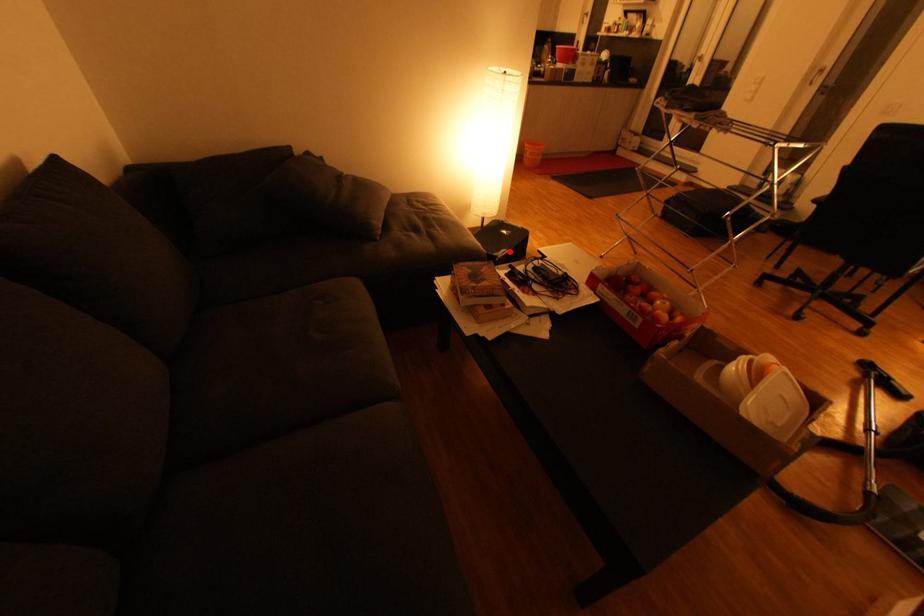
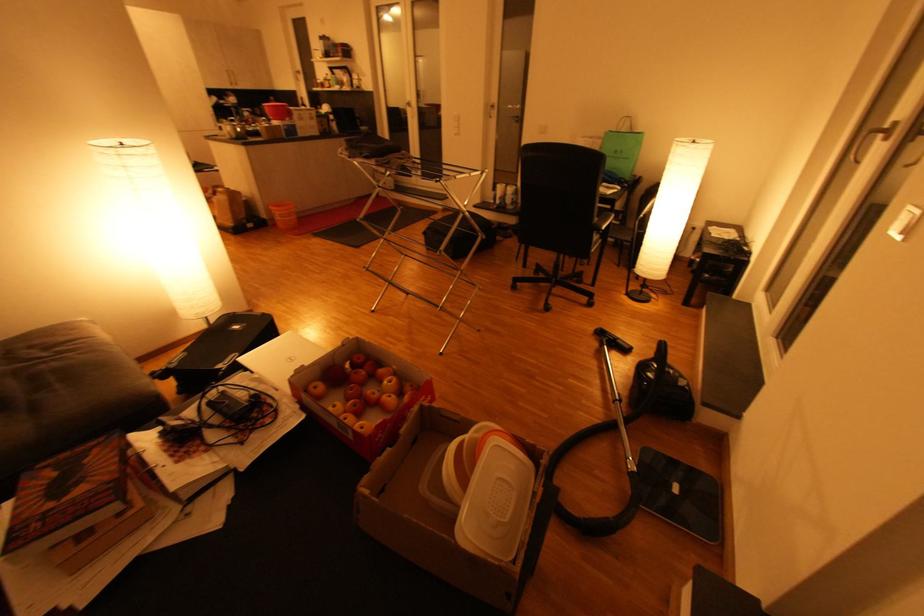
Locate, in the second image, the point that corresponds to the highlighted location in the first image.

(238, 357)